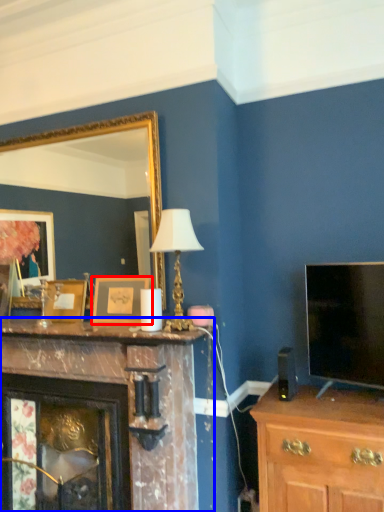
Question: Which point is further to the camera, picture frame (highlighted by a red box) or fireplace (highlighted by a blue box)?

Choices:
 (A) picture frame
 (B) fireplace

Answer: (A)